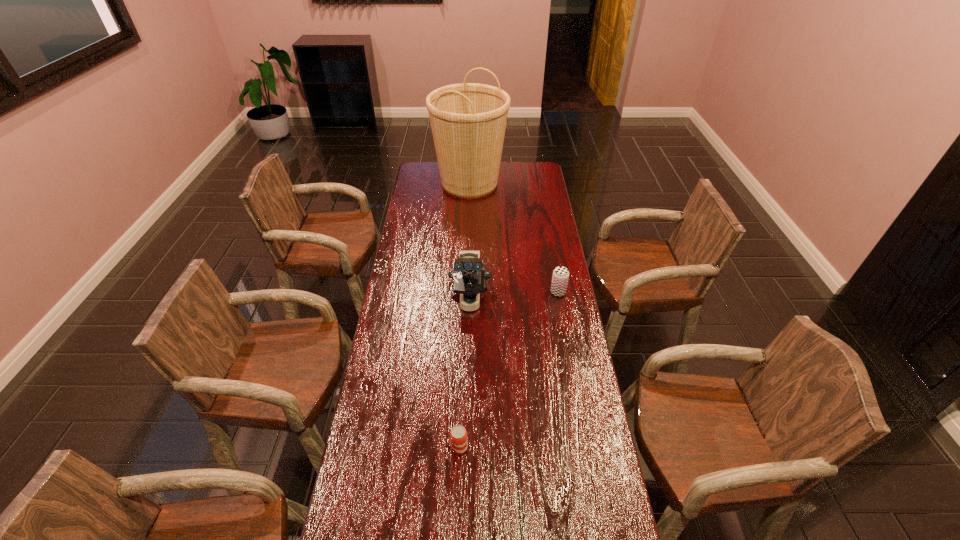
Locate an element on the screen. free point between the farthest object and the third tallest object is located at coordinates (514, 238).

Where is `vacant area that lies between the left beer can and the tallest object`? The height and width of the screenshot is (540, 960). vacant area that lies between the left beer can and the tallest object is located at coordinates (465, 316).

The width and height of the screenshot is (960, 540). What are the coordinates of `vacant space in between the farthest object and the taller beer can` in the screenshot? It's located at (514, 238).

Find the location of a particular element. The image size is (960, 540). vacant region between the rightmost object and the microscope is located at coordinates (514, 296).

The width and height of the screenshot is (960, 540). What are the coordinates of `empty space between the basket and the farther beer can` in the screenshot? It's located at (514, 238).

Where is `vacant region between the rightmost object and the left beer can`? This screenshot has width=960, height=540. vacant region between the rightmost object and the left beer can is located at coordinates (509, 370).

I want to click on free space between the basket and the taller beer can, so click(x=514, y=238).

This screenshot has width=960, height=540. I want to click on vacant area between the tallest object and the second tallest object, so [x=469, y=242].

Locate an element on the screen. The width and height of the screenshot is (960, 540). empty space that is in between the tallest object and the nearer beer can is located at coordinates (465, 316).

Image resolution: width=960 pixels, height=540 pixels. In order to click on object that is the second closest one to the microscope in this screenshot , I will do `click(458, 435)`.